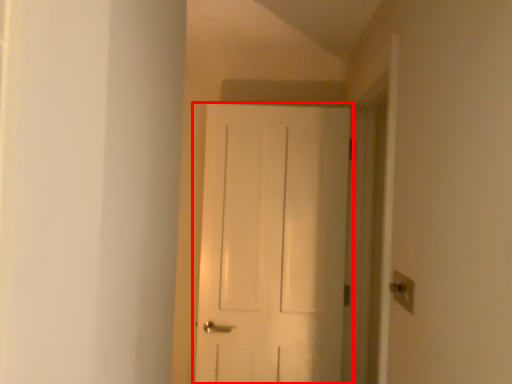
Question: From the image's perspective, what is the correct spatial positioning of door (annotated by the red box) in reference to light switch?

Choices:
 (A) above
 (B) below

Answer: (A)